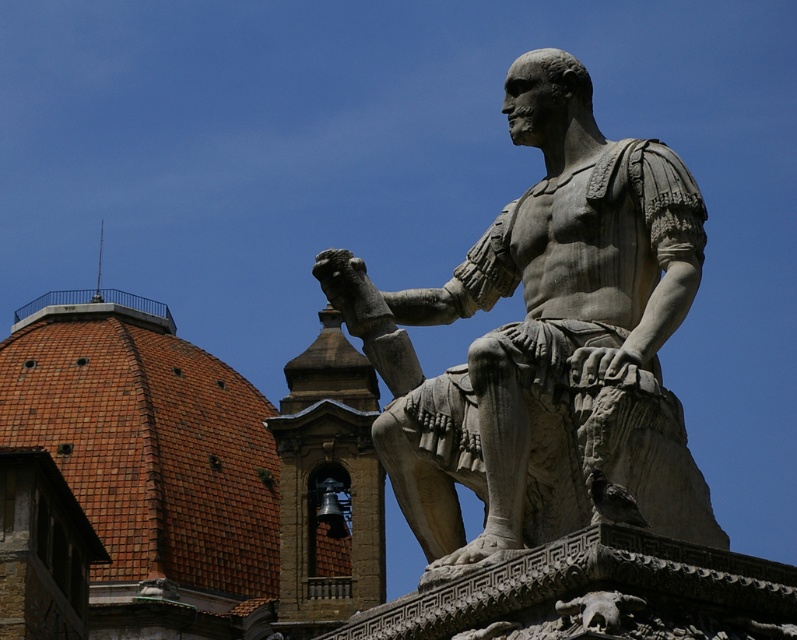
You are an art student visiting a historical site. You notice the gray stone statue at center and the bronze bell at center. Which object appears larger in the image?

The bronze bell at center appears larger than the gray stone statue at center in the image.

You are standing at point (548,344) in the image. What object is located exactly at this point?

The gray stone statue at center is located exactly at point (548,344).